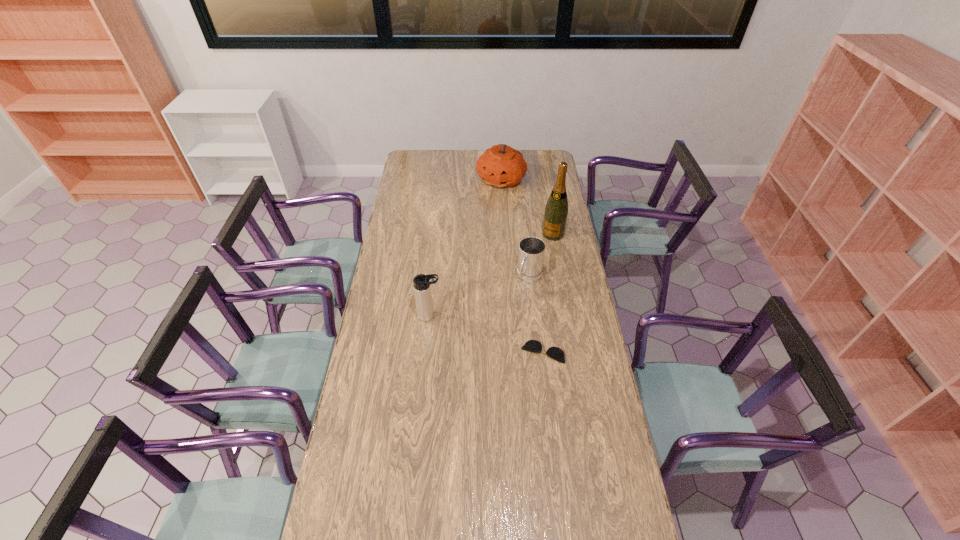
Find the location of a particular element. This screenshot has width=960, height=540. vacant space on the desktop that is between the fourth farthest object and the spectacles and is positioned on the front-facing side of the wine bottle is located at coordinates (491, 336).

Identify the location of free space on the desktop that is between the fourth farthest object and the shortest object and is positioned on the side of the third farthest object with the handle. The width and height of the screenshot is (960, 540). (490, 335).

The width and height of the screenshot is (960, 540). Identify the location of free spot on the desktop that is between the leftmost object and the spectacles and is positioned on the front-facing side of the farthest object. [477, 331].